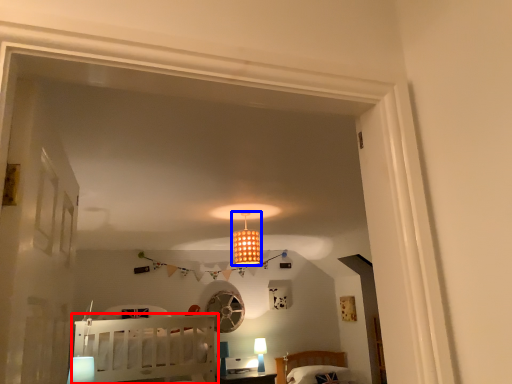
Question: Which of the following is the farthest to the observer, furniture (highlighted by a red box) or lamp (highlighted by a blue box)?

Choices:
 (A) furniture
 (B) lamp

Answer: (B)